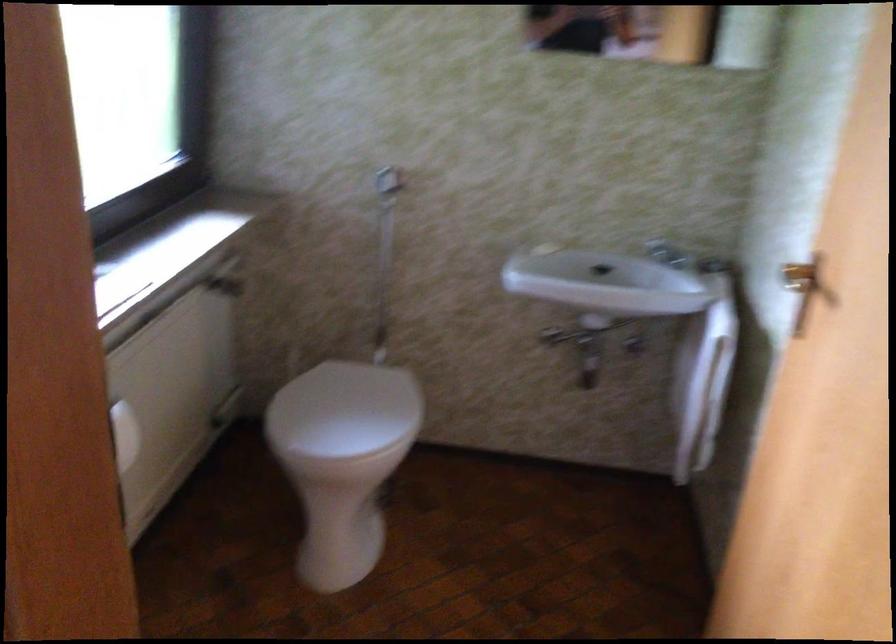
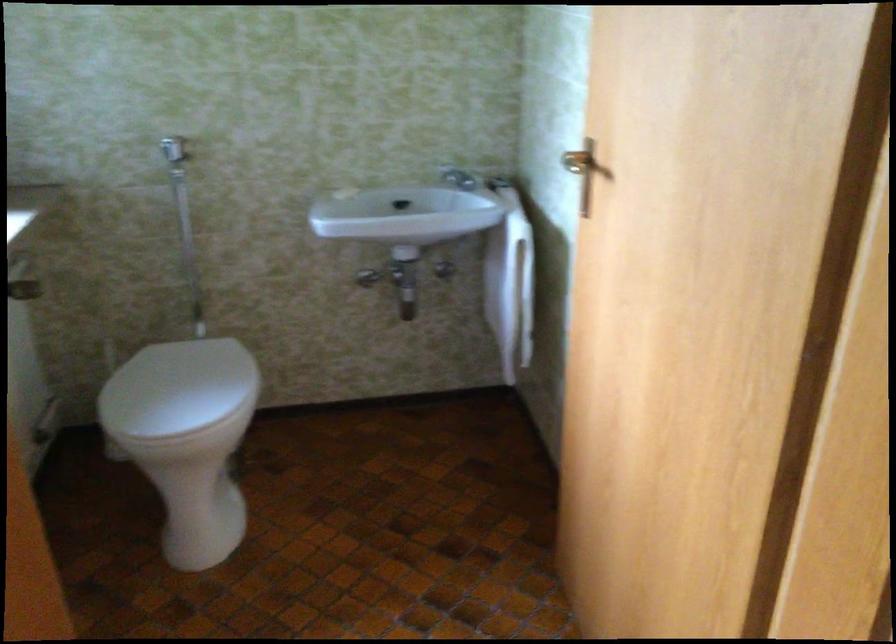
In the second image, find the point that corresponds to pixel 341 410 in the first image.

(177, 388)